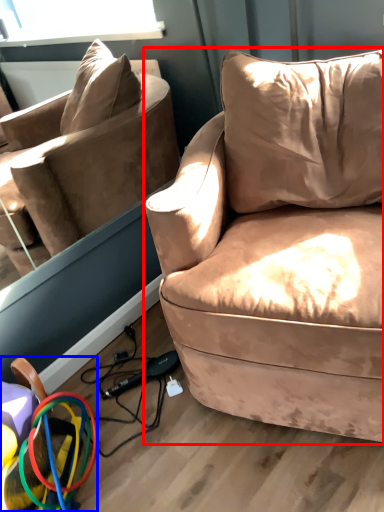
Question: Which object is closer to the camera taking this photo, studio couch (highlighted by a red box) or toy (highlighted by a blue box)?

Choices:
 (A) studio couch
 (B) toy

Answer: (A)